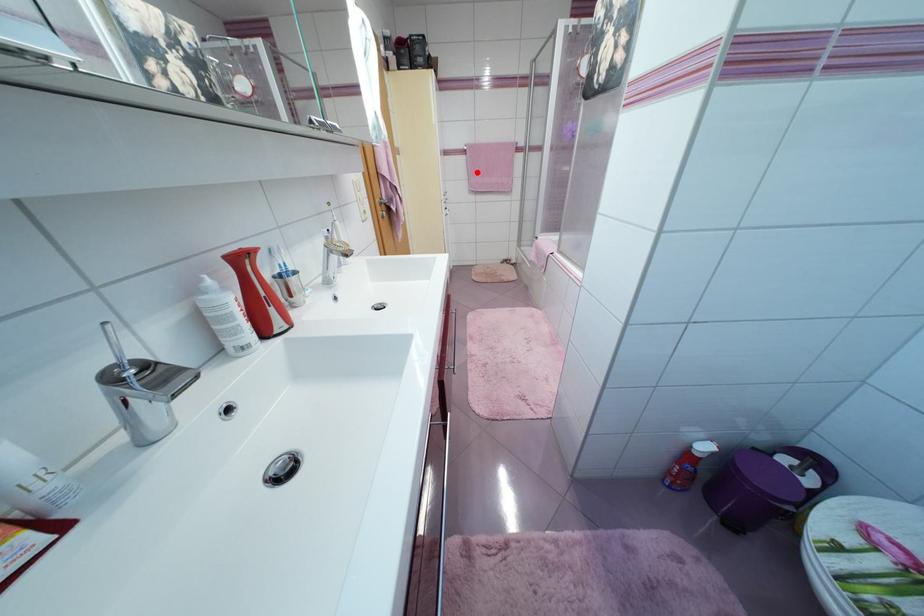
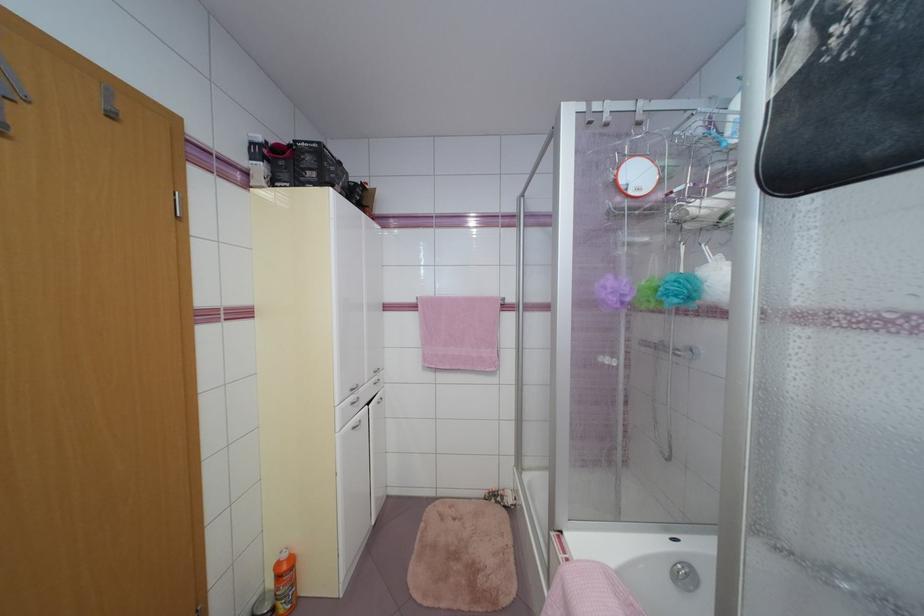
In the second image, find the point that corresponds to the highlighted location in the first image.

(433, 336)